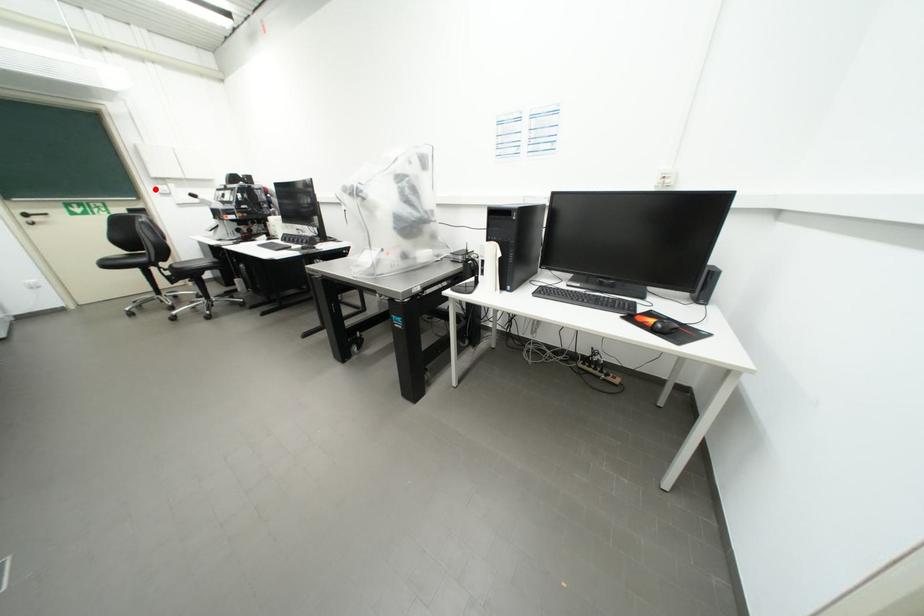
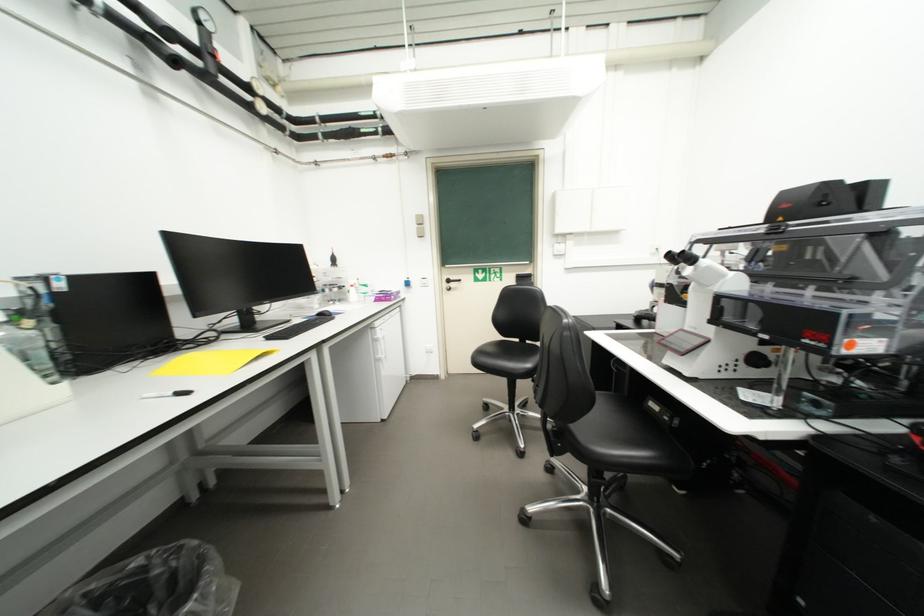
Question: I am providing you with two images of the same scene from different viewpoints. Given a red point in image1, look at the same physical point in image2. Is it:

Choices:
 (A) Closer to the viewpoint
 (B) Farther from the viewpoint

Answer: (A)